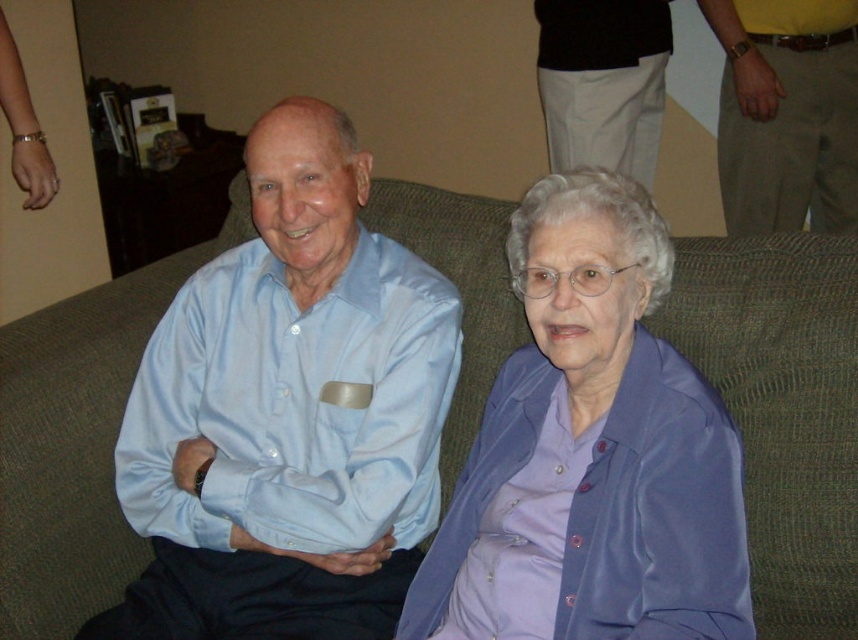
Question: Based on their relative distances, which object is nearer to the purple satin blouse at center?

Choices:
 (A) green fabric couch at center
 (B) light blue satin shirt at center

Answer: (B)

Question: Does light blue satin shirt at center come behind purple satin blouse at center?

Choices:
 (A) no
 (B) yes

Answer: (B)

Question: Which of the following is the closest to the observer?

Choices:
 (A) green fabric couch at center
 (B) light blue satin shirt at center
 (C) purple satin blouse at center

Answer: (C)

Question: Can you confirm if light blue satin shirt at center is positioned to the left of purple satin blouse at center?

Choices:
 (A) no
 (B) yes

Answer: (B)

Question: Can you confirm if green fabric couch at center is positioned to the right of purple satin blouse at center?

Choices:
 (A) yes
 (B) no

Answer: (A)

Question: Which object appears farthest from the camera in this image?

Choices:
 (A) light blue satin shirt at center
 (B) purple satin blouse at center
 (C) green fabric couch at center

Answer: (C)